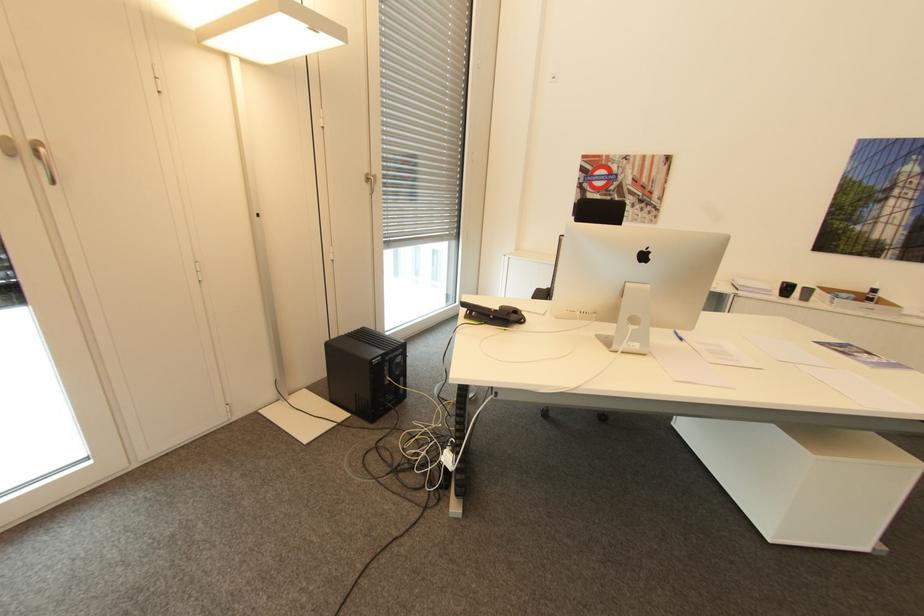
The width and height of the screenshot is (924, 616). I want to click on black telephone handset, so click(x=492, y=314).